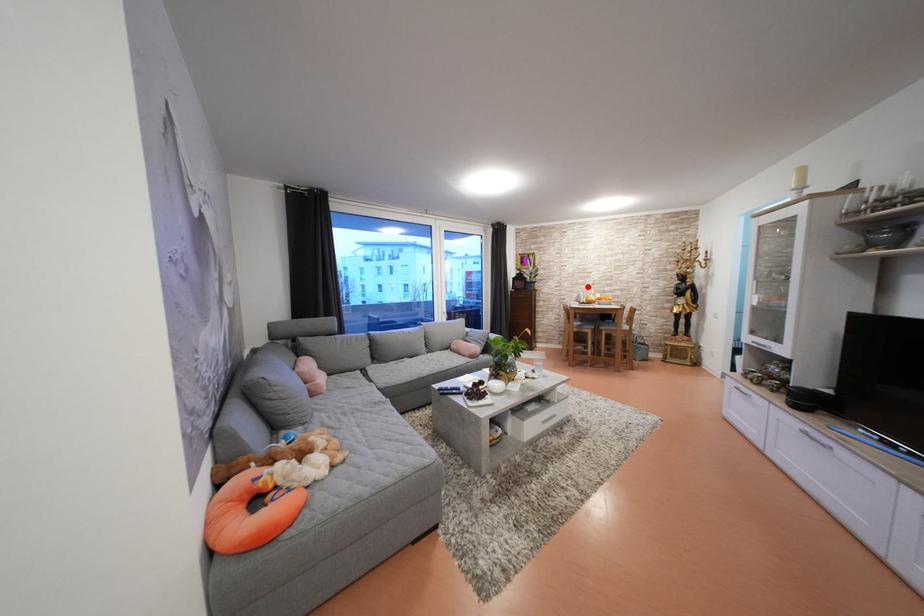
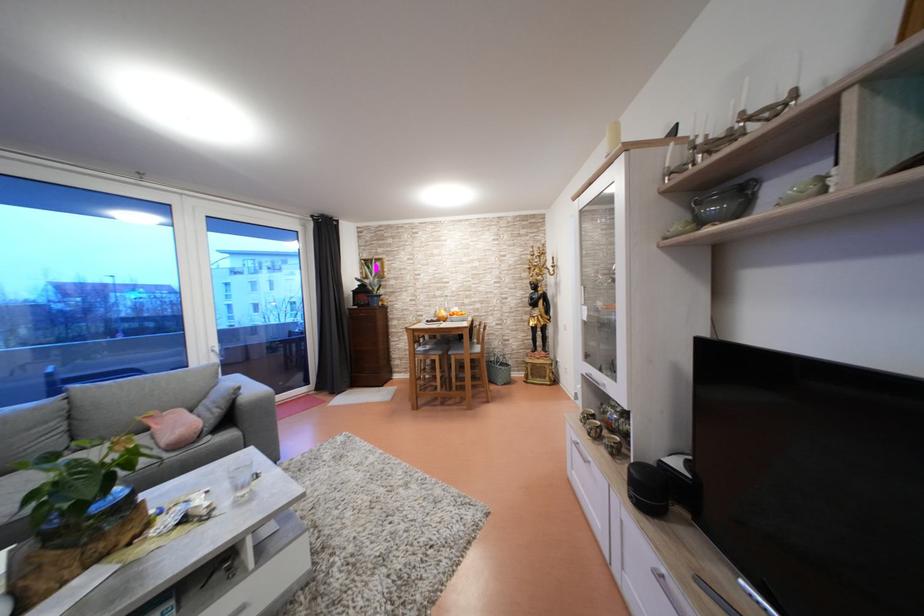
In the second image, find the point that corresponds to the highlighted location in the first image.

(444, 299)